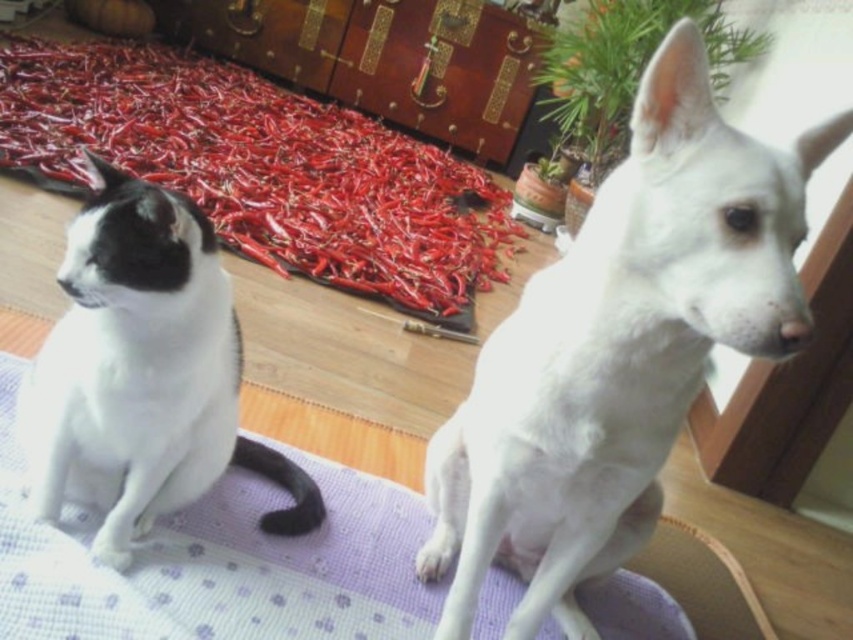
Does red matte peppers at center come behind purple fabric mat at center?

Yes, red matte peppers at center is behind purple fabric mat at center.

You are a GUI agent. You are given a task and a screenshot of the screen. Output one action in this format:
    pyautogui.click(x=<x>, y=<y>)
    Task: Click on the red matte peppers at center
    This screenshot has height=640, width=853.
    Given the screenshot: What is the action you would take?
    pyautogui.click(x=263, y=168)

The height and width of the screenshot is (640, 853). Identify the location of red matte peppers at center. (263, 168).

How much distance is there between red matte peppers at center and white fur cat at left?

red matte peppers at center and white fur cat at left are 5.54 feet apart.

Can you confirm if red matte peppers at center is taller than white fur cat at left?

Yes, red matte peppers at center is taller than white fur cat at left.

Does point (210, 115) come farther from viewer compared to point (54, 438)?

Yes, it is behind point (54, 438).

Where is `red matte peppers at center`? Image resolution: width=853 pixels, height=640 pixels. red matte peppers at center is located at coordinates (263, 168).

Is white fur dog at upper right bigger than purple fabric mat at center?

Incorrect, white fur dog at upper right is not larger than purple fabric mat at center.

Is white fur dog at upper right above purple fabric mat at center?

Yes, white fur dog at upper right is above purple fabric mat at center.

Who is more distant from viewer, (552,442) or (6,532)?

Positioned behind is point (6,532).

The image size is (853, 640). Identify the location of white fur dog at upper right. (618, 349).